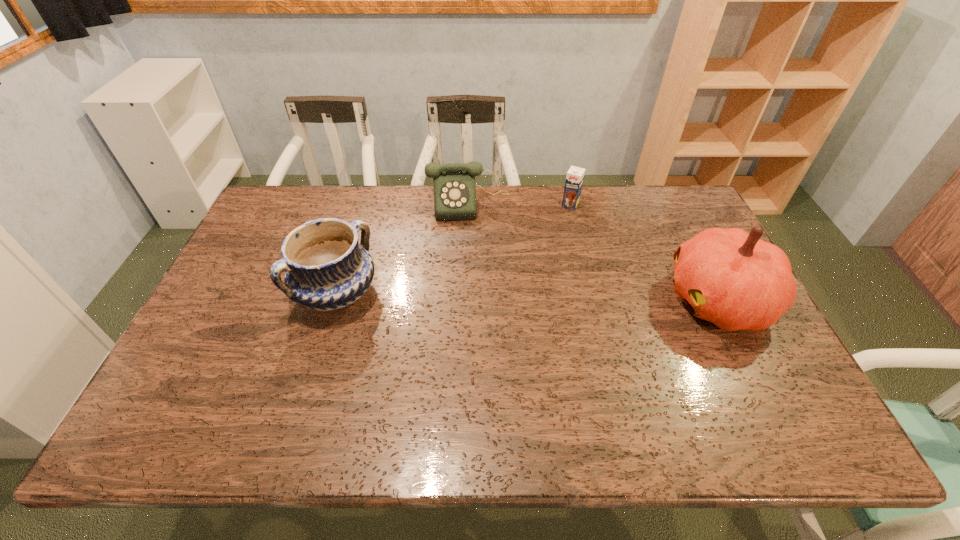
I want to click on vacant area that lies between the telephone and the tallest object, so click(x=593, y=252).

The width and height of the screenshot is (960, 540). Identify the location of vacant point located between the rightmost object and the telephone. (593, 252).

You are a GUI agent. You are given a task and a screenshot of the screen. Output one action in this format:
    pyautogui.click(x=<x>, y=<y>)
    Task: Click on the free space between the pottery and the rightmost object
    
    Given the screenshot: What is the action you would take?
    pyautogui.click(x=528, y=297)

Locate which object is the closest to the pumpkin. Please provide its 2D coordinates. Your answer should be formatted as a tuple, i.e. [(x, y)], where the tuple contains the x and y coordinates of a point satisfying the conditions above.

[(574, 180)]

Select which object appears as the second closest to the telephone. Please provide its 2D coordinates. Your answer should be formatted as a tuple, i.e. [(x, y)], where the tuple contains the x and y coordinates of a point satisfying the conditions above.

[(326, 268)]

Where is `vacant space that satisfies the following two spatial constraints: 1. on the front side of the rightmost object; 2. on the front-facing side of the pottery`? This screenshot has width=960, height=540. vacant space that satisfies the following two spatial constraints: 1. on the front side of the rightmost object; 2. on the front-facing side of the pottery is located at coordinates pos(335,300).

Where is `free point that satisfies the following two spatial constraints: 1. on the back side of the telephone; 2. on the left side of the leftmost object`? The height and width of the screenshot is (540, 960). free point that satisfies the following two spatial constraints: 1. on the back side of the telephone; 2. on the left side of the leftmost object is located at coordinates (365, 203).

Find the location of a particular element. This screenshot has height=540, width=960. vacant position in the image that satisfies the following two spatial constraints: 1. on the back side of the chocolate milk; 2. on the right side of the leftmost object is located at coordinates coord(364,205).

Find the location of `free space in the image that satisfies the following two spatial constraints: 1. on the front side of the rightmost object; 2. on the front-facing side of the third object from left to right`. free space in the image that satisfies the following two spatial constraints: 1. on the front side of the rightmost object; 2. on the front-facing side of the third object from left to right is located at coordinates (592, 300).